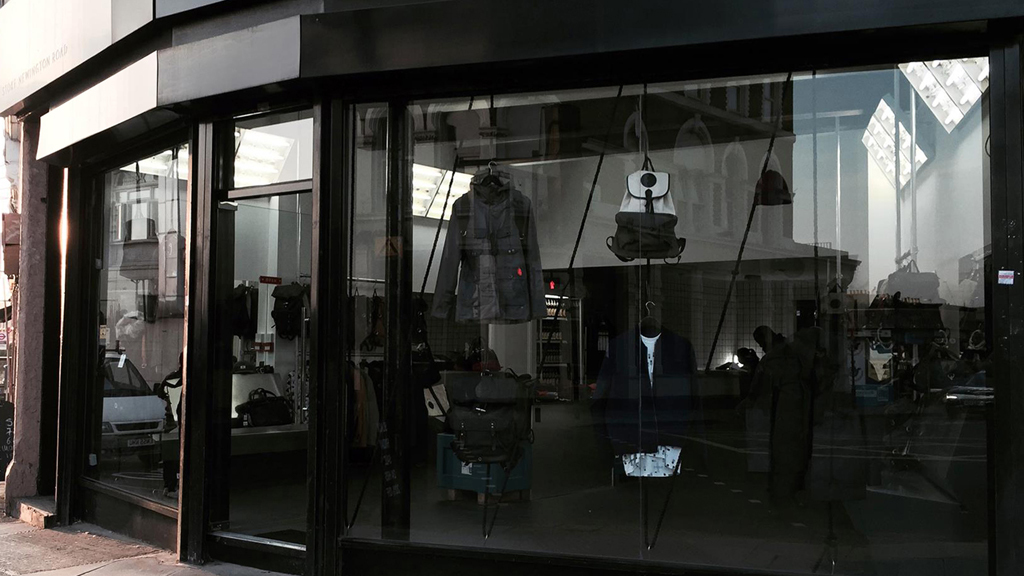
In order to click on shelves in this screenshot , I will do `click(569, 351)`.